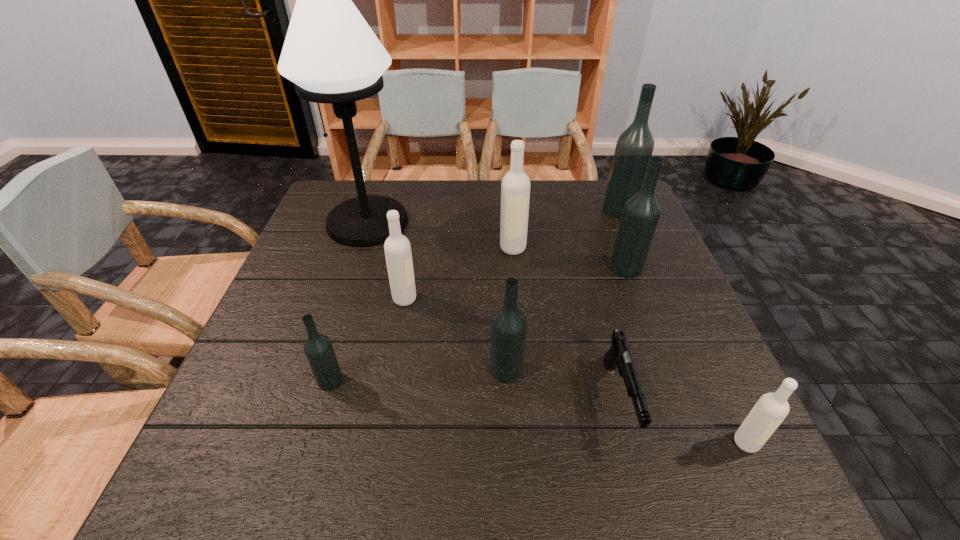
Identify the location of object that is at the left edge. (330, 53).

You are a GUI agent. You are given a task and a screenshot of the screen. Output one action in this format:
    pyautogui.click(x=<x>, y=<y>)
    Task: Click on the object that is positioned at the far left corner
    The height and width of the screenshot is (540, 960).
    Given the screenshot: What is the action you would take?
    pyautogui.click(x=330, y=53)

Where is `object that is at the far right corner`? The image size is (960, 540). object that is at the far right corner is located at coordinates (634, 147).

You are a GUI agent. You are given a task and a screenshot of the screen. Output one action in this format:
    pyautogui.click(x=<x>, y=<y>)
    Task: Click on the object that is at the near right corner
    The width and height of the screenshot is (960, 540).
    Given the screenshot: What is the action you would take?
    point(771,409)

The width and height of the screenshot is (960, 540). In the image, there is a desktop. What are the coordinates of `vacant space at the left edge` in the screenshot? It's located at (286, 281).

I want to click on free space at the right edge of the desktop, so click(x=630, y=314).

The width and height of the screenshot is (960, 540). What are the coordinates of `vacant space at the far left corner of the desktop` in the screenshot? It's located at (328, 202).

At what (x,y) coordinates should I click in order to perform the action: click on free space at the near left corner of the desktop. Please return your answer as a coordinate pair (x, y). The image size is (960, 540). Looking at the image, I should click on (259, 470).

Find the location of a particular element. free space between the farthest white vodka and the leftmost vodka is located at coordinates (421, 314).

The image size is (960, 540). In order to click on free area in between the tallest object and the shortest object in this screenshot , I will do `click(493, 311)`.